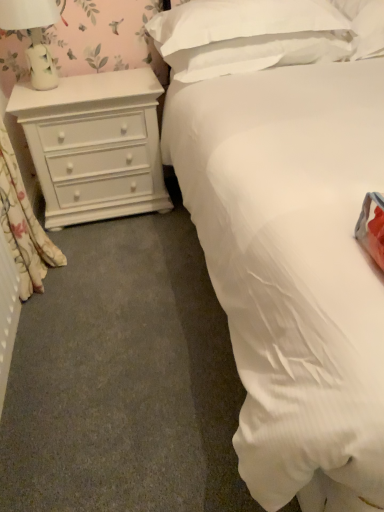
Question: Is white matte chest of drawers at left in front of or behind white ceramic lamp at upper left in the image?

Choices:
 (A) behind
 (B) front

Answer: (A)

Question: Considering the positions of white matte chest of drawers at left and white ceramic lamp at upper left in the image, is white matte chest of drawers at left bigger or smaller than white ceramic lamp at upper left?

Choices:
 (A) big
 (B) small

Answer: (A)

Question: Which of these objects is positioned closest to the white matte chest of drawers at left?

Choices:
 (A) white ceramic lamp at upper left
 (B) floral fabric curtain at left
 (C) white soft pillow at upper center, the first pillow from the right
 (D) white soft pillow at upper center, marked as the 2th pillow in a right-to-left arrangement

Answer: (A)

Question: Which object is positioned farthest from the white soft pillow at upper center, positioned as the first pillow in left-to-right order?

Choices:
 (A) white matte chest of drawers at left
 (B) floral fabric curtain at left
 (C) white ceramic lamp at upper left
 (D) white soft pillow at upper center, acting as the 2th pillow starting from the left

Answer: (B)